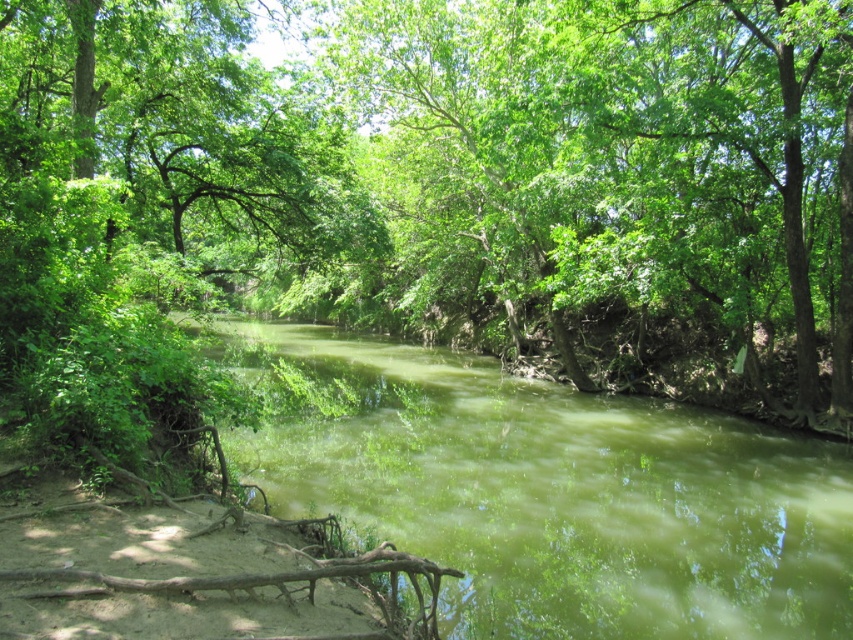
Question: In this image, where is green leafy tree at center located relative to green murky water at center?

Choices:
 (A) left
 (B) right

Answer: (A)

Question: Which point is farther from the camera taking this photo?

Choices:
 (A) (729, 515)
 (B) (694, 42)

Answer: (B)

Question: Does green leafy tree at center appear on the left side of green murky water at center?

Choices:
 (A) no
 (B) yes

Answer: (B)

Question: Is green leafy tree at center in front of green murky water at center?

Choices:
 (A) yes
 (B) no

Answer: (B)

Question: Which object appears farthest from the camera in this image?

Choices:
 (A) green leafy tree at center
 (B) green murky water at center

Answer: (A)